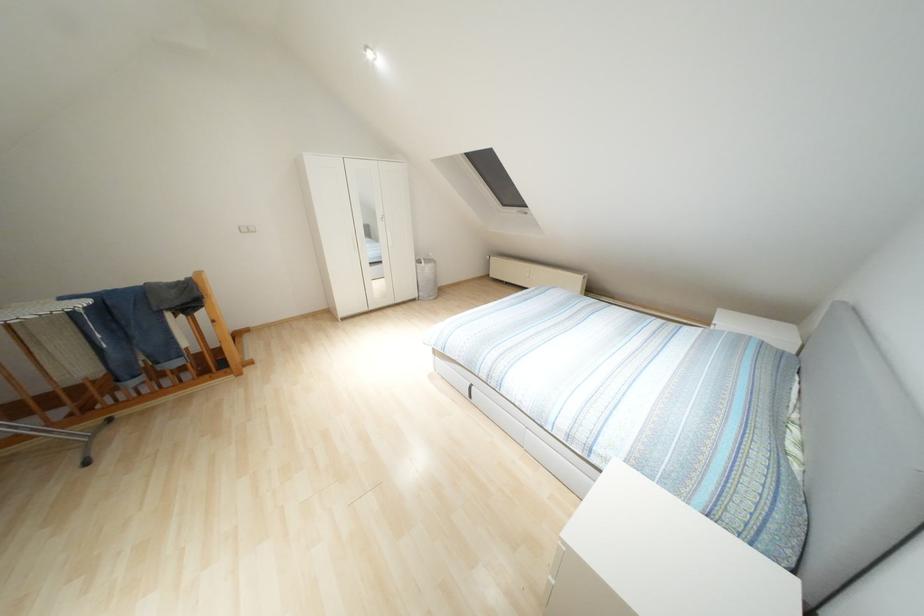
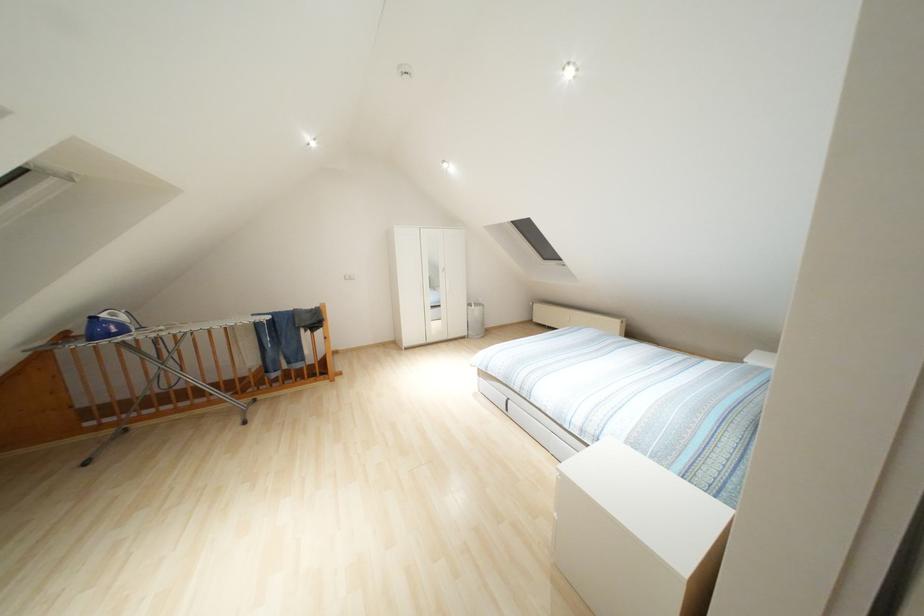
Where in the second image is the point corresponding to [426,268] from the first image?

(476, 310)